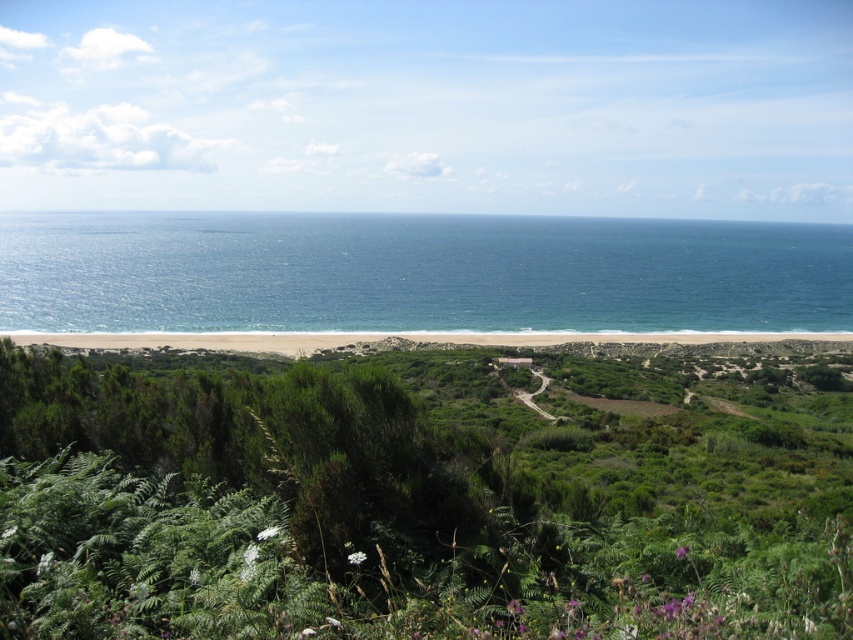
Is point (442, 387) more distant than point (428, 296)?

No.

Where is `green leafy shrubs at center`? green leafy shrubs at center is located at coordinates (418, 499).

The image size is (853, 640). In order to click on green leafy shrubs at center in this screenshot , I will do `click(418, 499)`.

Between green leafy shrubs at center and white sand beach at lower center, which one has more height?

green leafy shrubs at center

Locate an element on the screen. This screenshot has height=640, width=853. green leafy shrubs at center is located at coordinates (418, 499).

Describe the element at coordinates (418, 499) in the screenshot. This screenshot has height=640, width=853. I see `green leafy shrubs at center` at that location.

Locate an element on the screen. Image resolution: width=853 pixels, height=640 pixels. green leafy shrubs at center is located at coordinates (418, 499).

Can you confirm if blue water at center is taller than white sand beach at lower center?

Yes, blue water at center is taller than white sand beach at lower center.

Can you confirm if blue water at center is smaller than white sand beach at lower center?

No.

Who is more distant from viewer, [584,316] or [260,344]?

The point [584,316] is behind.

Find the location of a particular element. blue water at center is located at coordinates (416, 273).